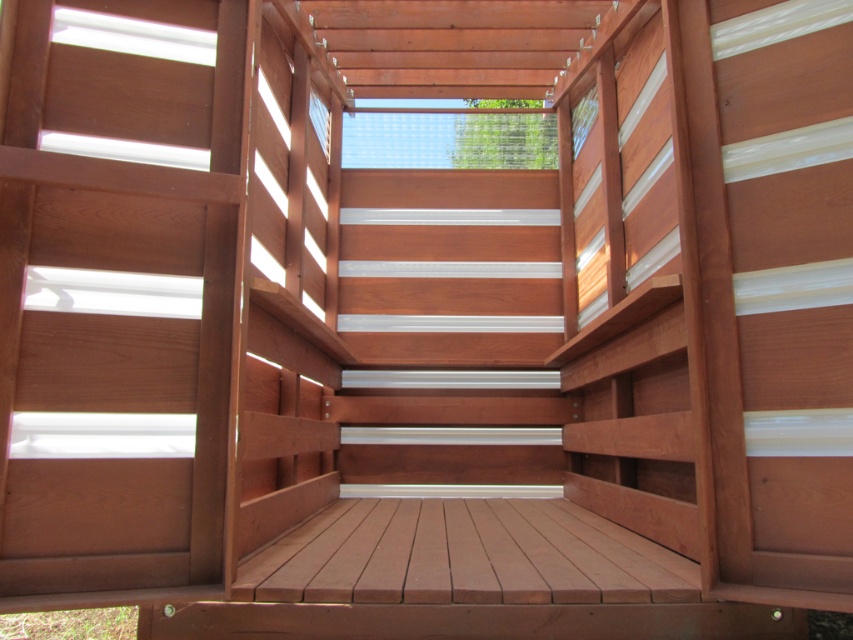
What are the coordinates of `satin wood stair at left` in the screenshot? It's located at (123, 314).

Can you confirm if satin wood stair at left is shorter than white smooth stair at center?

Yes.

Does point (119, 260) come in front of point (456, 308)?

Yes, it is.

Identify the location of satin wood stair at left. The width and height of the screenshot is (853, 640). (123, 314).